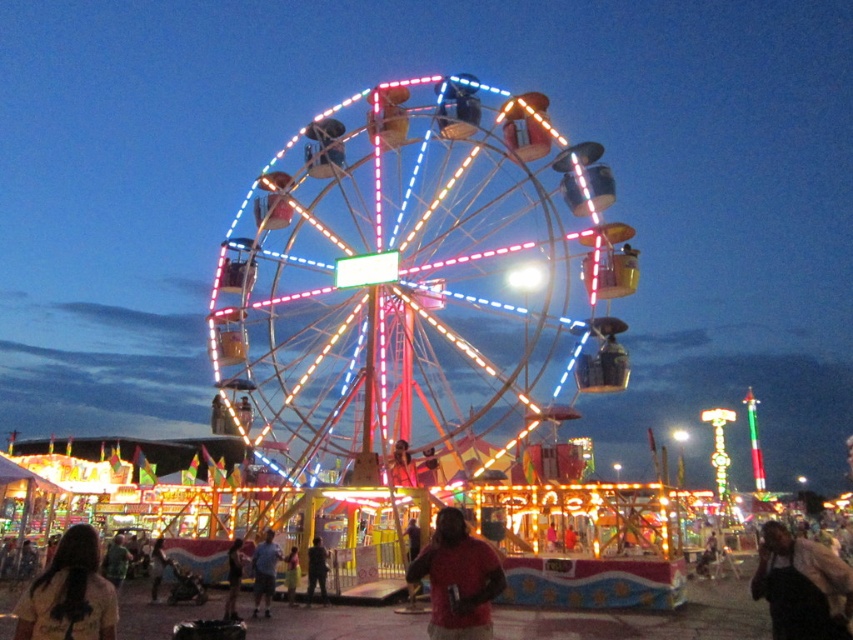
Can you confirm if dark gray pants at center is shorter than light brown leather jacket at center?

No.

Does dark gray pants at center appear on the right side of light brown leather jacket at center?

Correct, you'll find dark gray pants at center to the right of light brown leather jacket at center.

Who is more forward, (306, 584) or (294, 564)?

Point (294, 564)

You are a GUI agent. You are given a task and a screenshot of the screen. Output one action in this format:
    pyautogui.click(x=<x>, y=<y>)
    Task: Click on the dark gray pants at center
    
    Given the screenshot: What is the action you would take?
    pyautogui.click(x=316, y=570)

Based on the photo, can you confirm if dark gray pants at center is positioned above smooth blue shirt at center?

Indeed, dark gray pants at center is positioned over smooth blue shirt at center.

Does point (323, 604) come farther from viewer compared to point (238, 577)?

That is False.

Locate an element on the screen. This screenshot has height=640, width=853. dark gray pants at center is located at coordinates (316, 570).

Does point (268, 554) lie in front of point (297, 556)?

Yes, point (268, 554) is in front of point (297, 556).

Can you confirm if blue denim shorts at center is bigger than light brown leather jacket at center?

Correct, blue denim shorts at center is larger in size than light brown leather jacket at center.

The width and height of the screenshot is (853, 640). What do you see at coordinates (264, 572) in the screenshot? I see `blue denim shorts at center` at bounding box center [264, 572].

At what (x,y) coordinates should I click in order to perform the action: click on blue denim shorts at center. Please return your answer as a coordinate pair (x, y). Looking at the image, I should click on (264, 572).